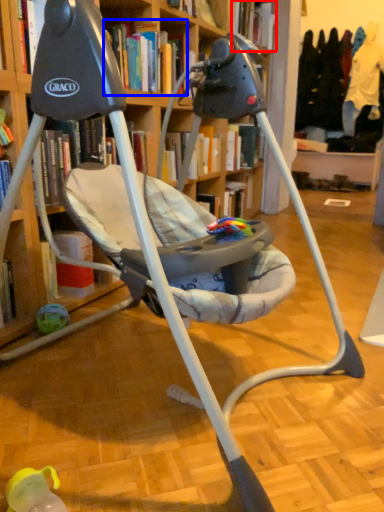
Question: Which object is further to the camera taking this photo, book (highlighted by a red box) or book (highlighted by a blue box)?

Choices:
 (A) book
 (B) book

Answer: (A)